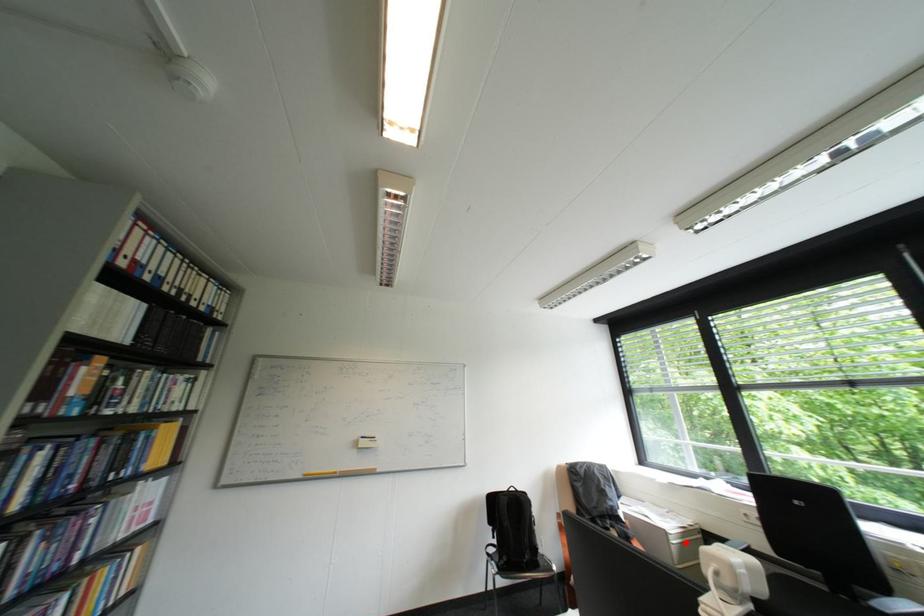
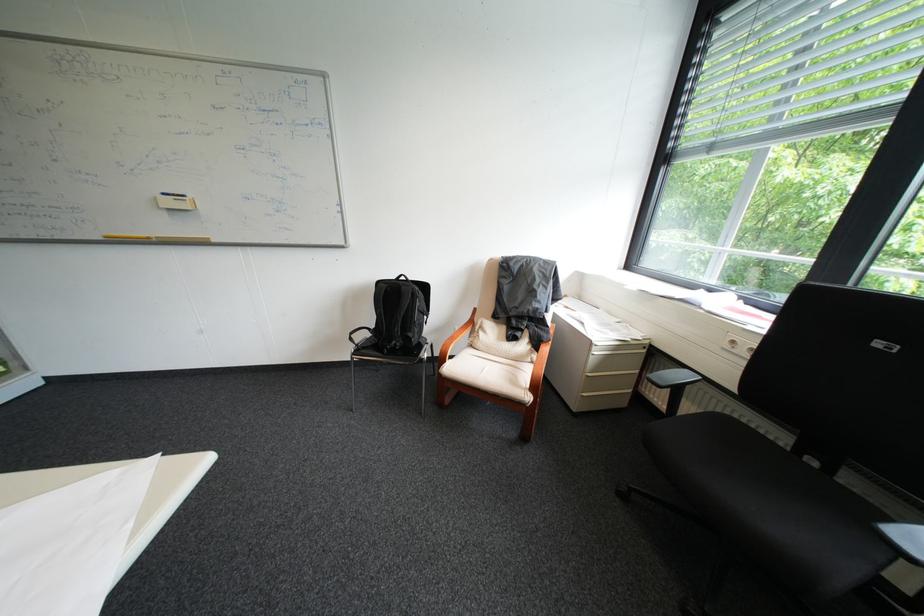
Locate, in the second image, the point that corresponds to the highlighted location in the first image.

(609, 353)